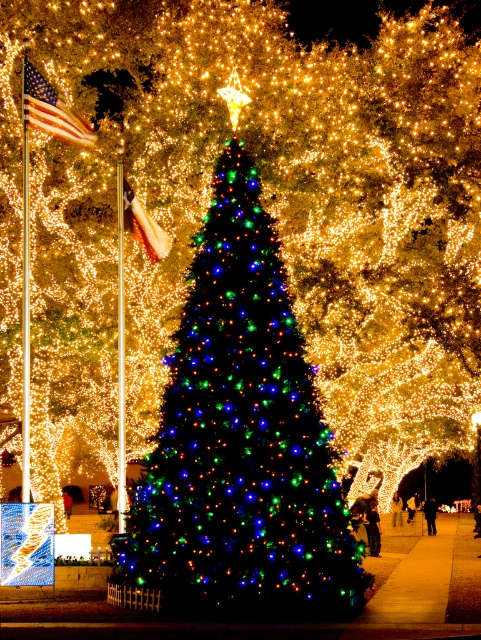
You are standing at the entrance of the festive scene and see the point marked as point (142, 227). What object is located at that point?

The silky white flag at center is located at point (142, 227).

You are planning to take a photo of the multicolored lights christmas tree at center and the dark brown leather jacket at center. Which object should you focus on first if you want to capture both in a single frame without moving the camera?

You should focus on the multicolored lights christmas tree at center first because it is wider than the dark brown leather jacket at center, ensuring it fits properly in the frame.

You are standing at the point marked by the coordinate point (240, 444). What object is directly in front of you?

The point (240, 444) marks the multicolored lights Christmas tree at center, so the object directly in front of you is the multicolored lights Christmas tree at center.